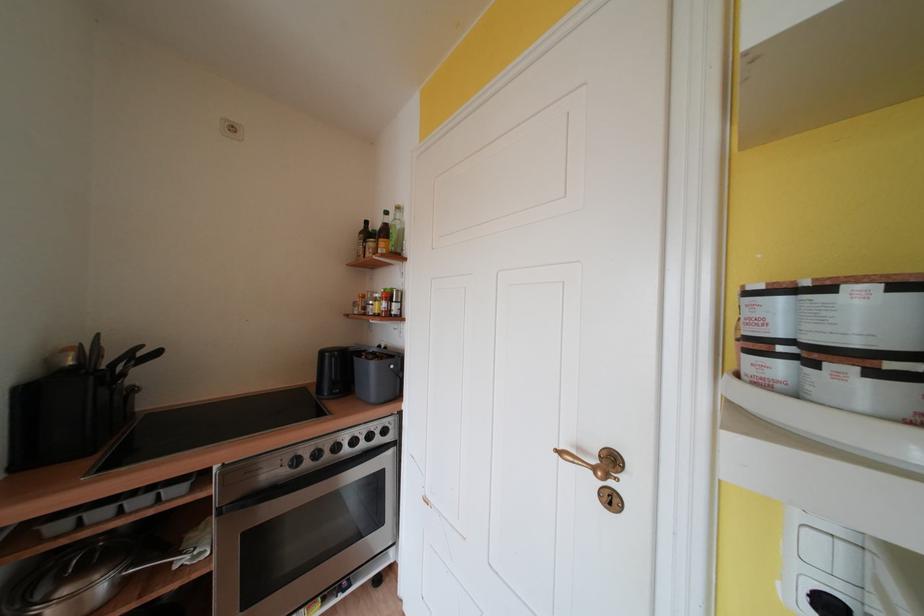
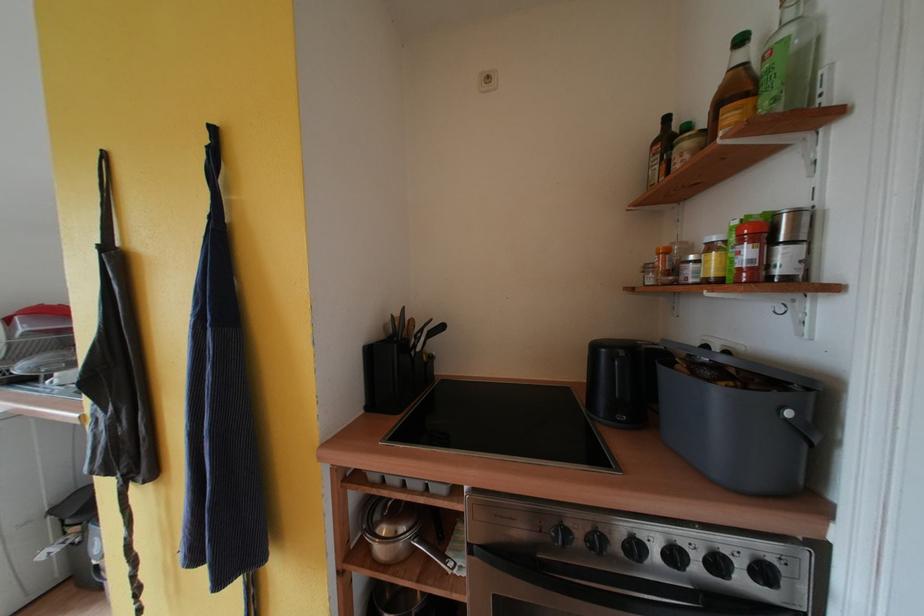
Locate, in the second image, the point that corresponds to pixel 225 517 in the first image.

(478, 553)